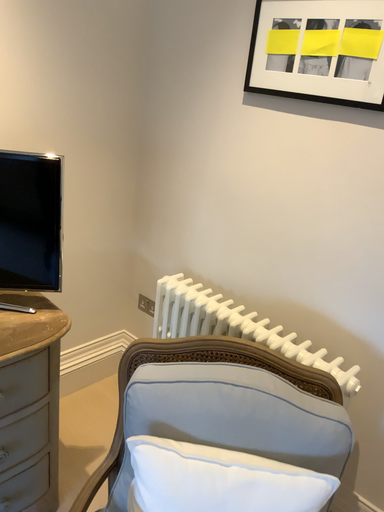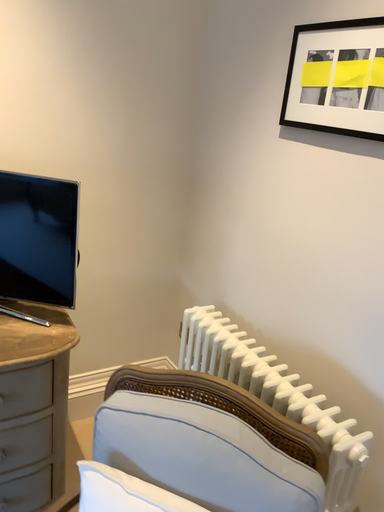
Question: How did the camera likely rotate when shooting the video?

Choices:
 (A) rotated right
 (B) rotated left

Answer: (B)